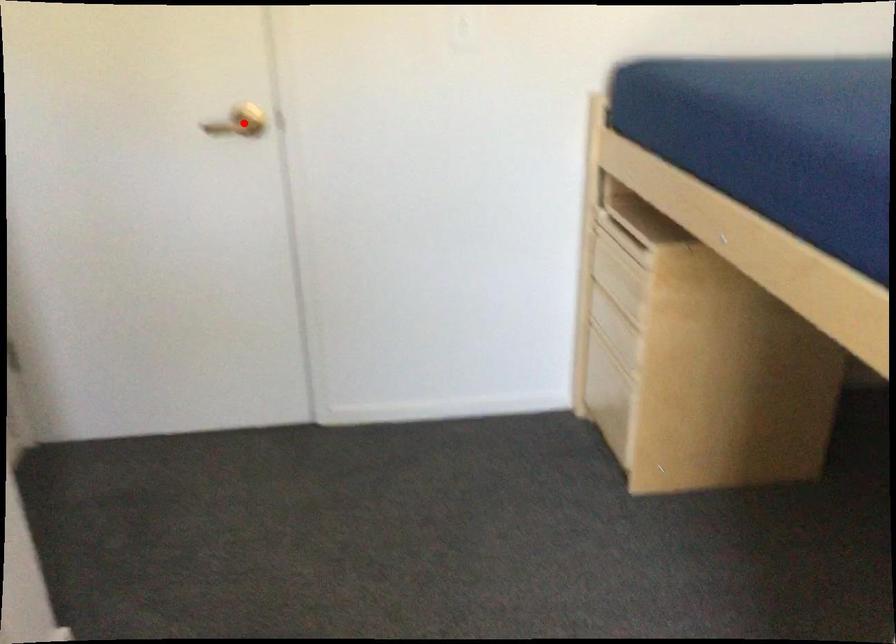
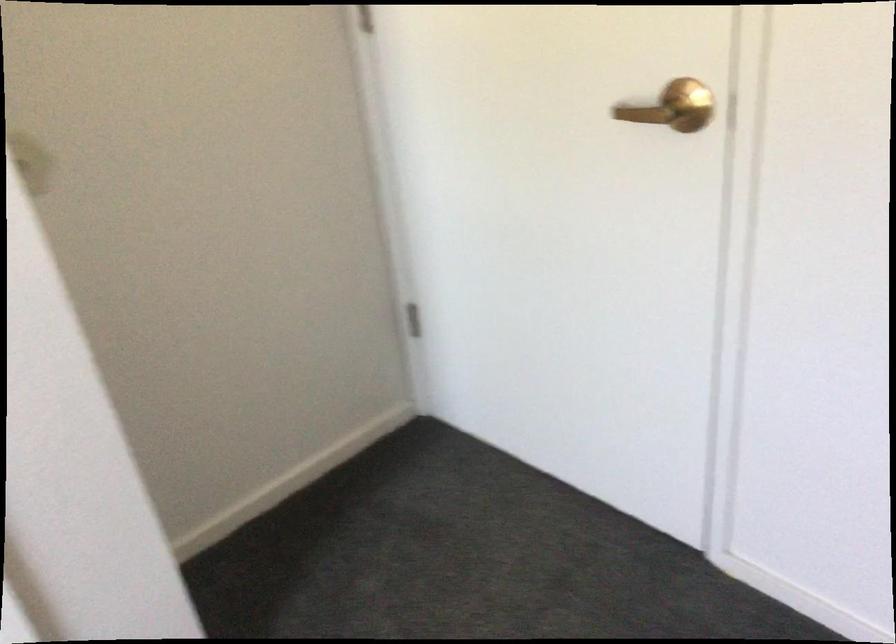
Question: I am providing you with two images of the same scene from different viewpoints. A red point is shown in image1. For the corresponding object point in image2, is it positioned nearer or farther from the camera?

Choices:
 (A) Nearer
 (B) Farther

Answer: (A)